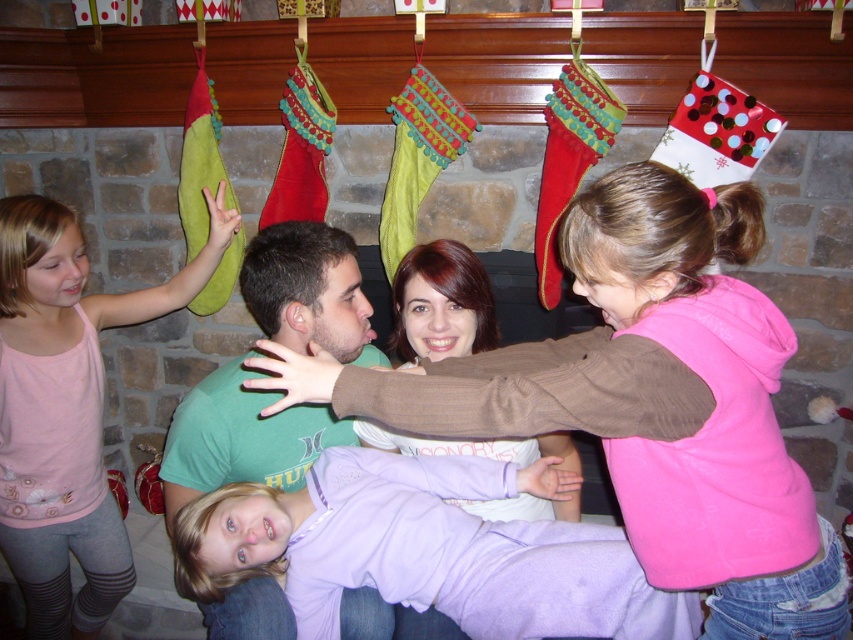
Question: Does pink fleece hoodie at upper right appear on the right side of pink fabric dress at left?

Choices:
 (A) yes
 (B) no

Answer: (A)

Question: Among these objects, which one is farthest from the camera?

Choices:
 (A) pink fleece hoodie at upper right
 (B) pink fabric dress at left

Answer: (B)

Question: Among these points, which one is farthest from the camera?

Choices:
 (A) (587, 424)
 (B) (73, 241)

Answer: (B)

Question: Can you confirm if pink fleece hoodie at upper right is positioned to the left of pink fabric dress at left?

Choices:
 (A) no
 (B) yes

Answer: (A)

Question: Does pink fleece hoodie at upper right appear on the left side of pink fabric dress at left?

Choices:
 (A) no
 (B) yes

Answer: (A)

Question: Which object appears closest to the camera in this image?

Choices:
 (A) pink fabric dress at left
 (B) pink fleece hoodie at upper right

Answer: (B)